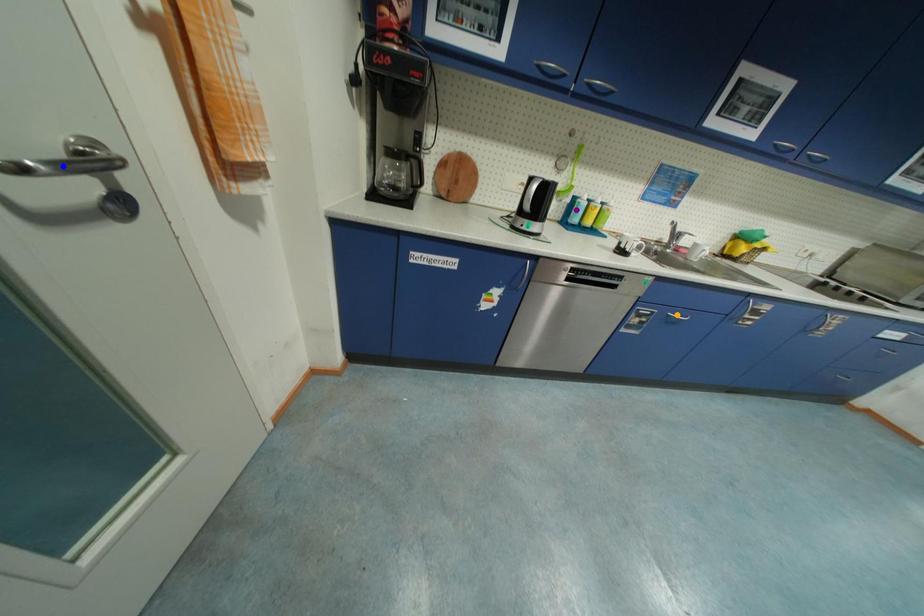
Order these from nearest to farthest:
1. orange point
2. purple point
3. blue point

1. purple point
2. orange point
3. blue point